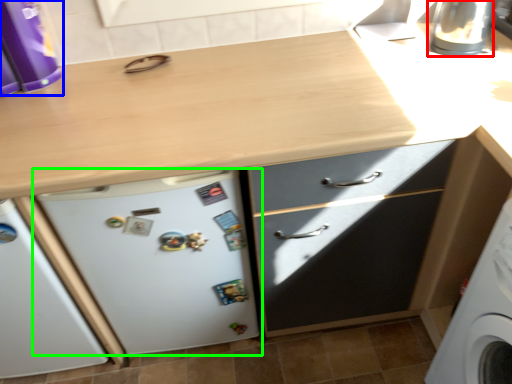
Question: Estimate the real-world distances between objects in this image. Which object is closer to appliance (highlighted by a red box), kitchen appliance (highlighted by a blue box) or refrigerator (highlighted by a green box)?

Choices:
 (A) kitchen appliance
 (B) refrigerator

Answer: (B)